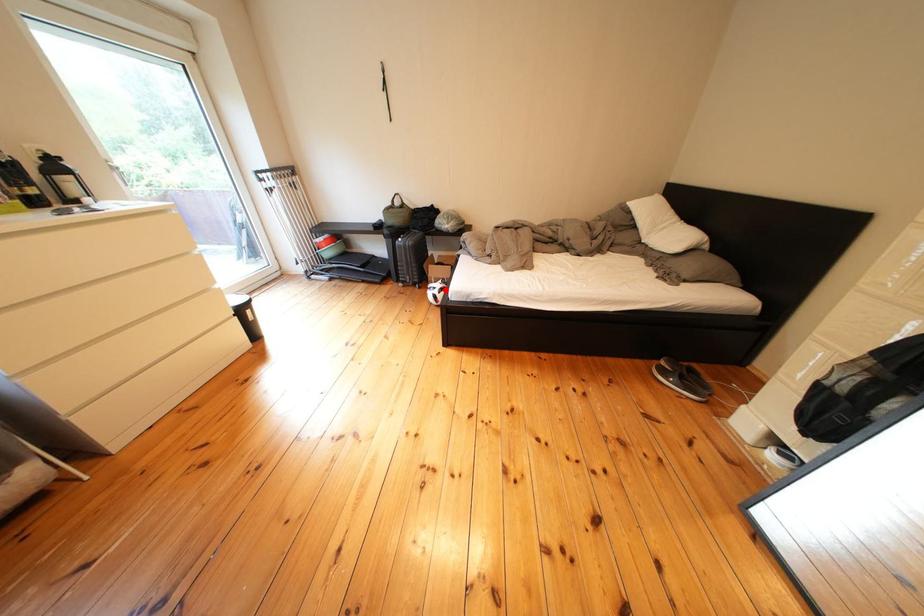
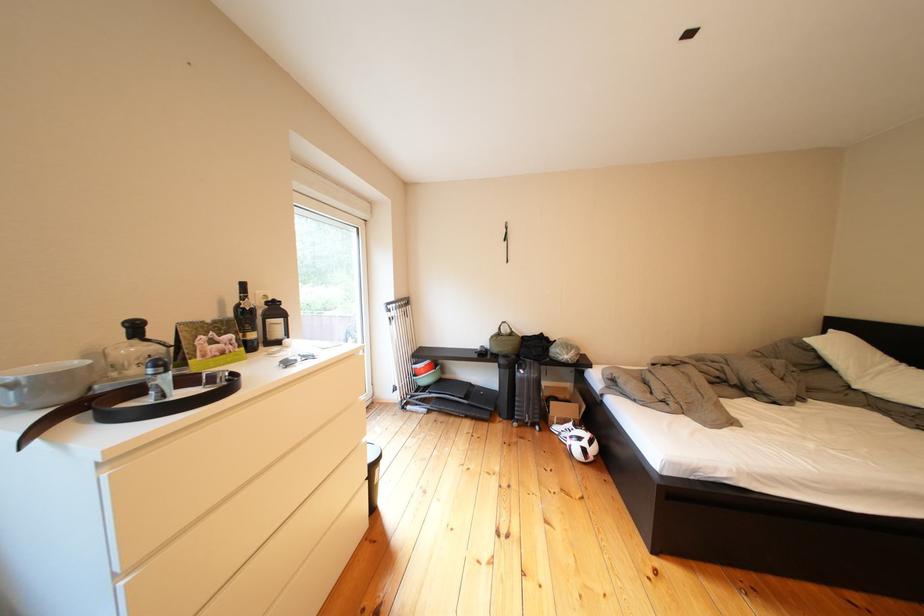
Locate, in the second image, the point that corresponds to the highlighted location in the first image.

(570, 432)